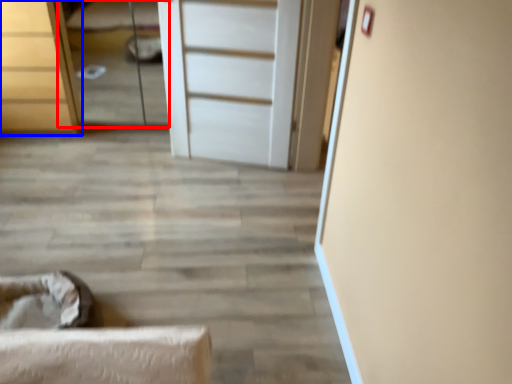
Question: Which object is closer to the camera taking this photo, bed (highlighted by a red box) or chest of drawers (highlighted by a blue box)?

Choices:
 (A) bed
 (B) chest of drawers

Answer: (B)